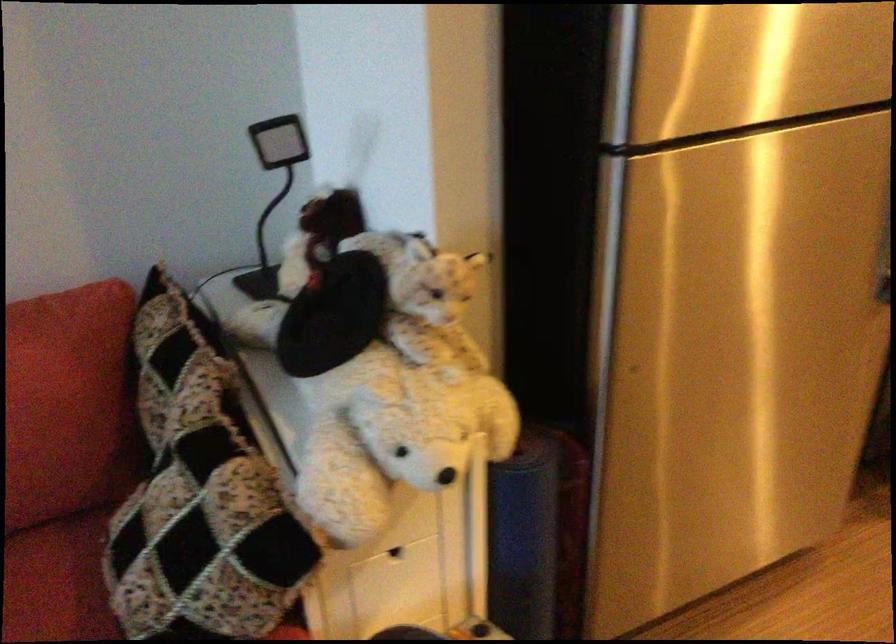
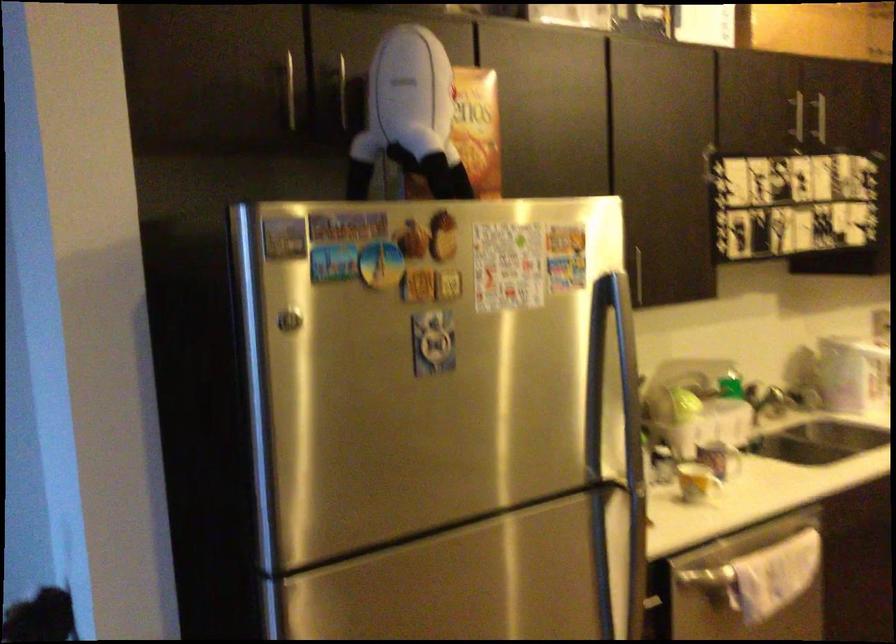
Question: The first image is from the beginning of the video and the second image is from the end. How did the camera likely rotate when shooting the video?

Choices:
 (A) Left
 (B) Right
 (C) Up
 (D) Down

Answer: (C)